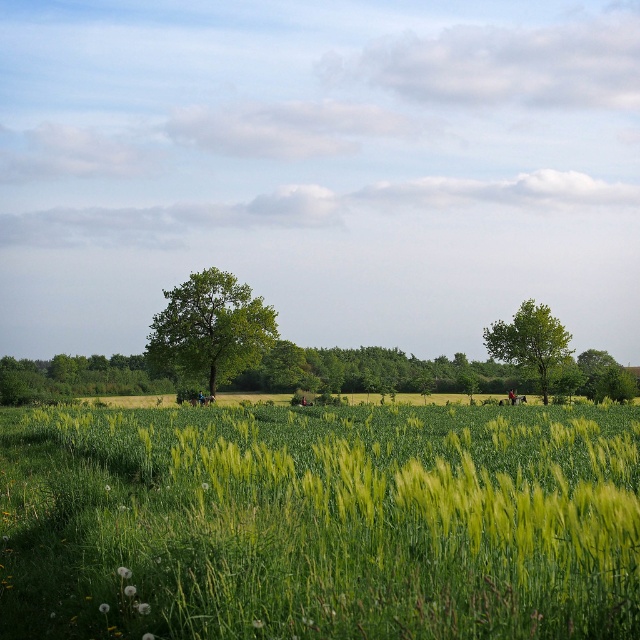
You are a farmer planning to install a fence between the green grassy wheat field at center and the green leafy tree at right. Given that the minimum required distance for such a fence is 150 feet, will the existing spacing between them allow you to place the fence without violating regulations?

The green grassy wheat field at center and green leafy tree at right are 157.26 feet apart from each other. Since 157.26 feet is greater than the minimum required 150 feet, the existing spacing allows placing the fence without violating regulations.

Looking at this image, you are a farmer standing in the middle of the green grassy wheat field at center. You want to reach the green leafy tree at center to check its health. In which direction should you walk to get there?

The green leafy tree at center is located above the green grassy wheat field at center, so you should walk upwards to reach it.

You are a farmer checking the growth of your crops and trees. You notice the green grassy wheat field at center and the green leafy tree at center. Which one is shorter in height?

The green grassy wheat field at center is shorter in height compared to the green leafy tree at center.